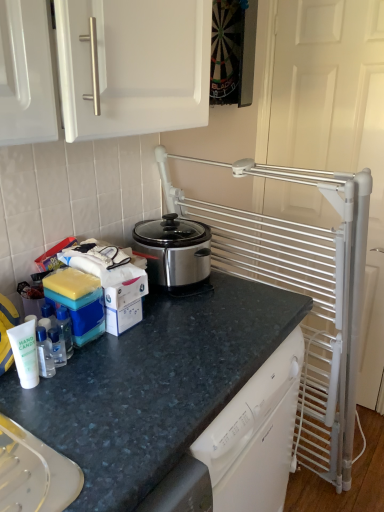
Where is `vacant area to the right of stainless steel slow cooker at center`? vacant area to the right of stainless steel slow cooker at center is located at coordinates (x=245, y=296).